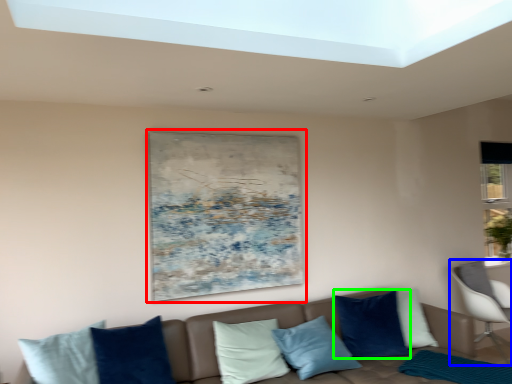
Question: Estimate the real-world distances between objects in this image. Which object is closer to picture frame (highlighted by a red box), chair (highlighted by a blue box) or pillow (highlighted by a green box)?

Choices:
 (A) chair
 (B) pillow

Answer: (B)